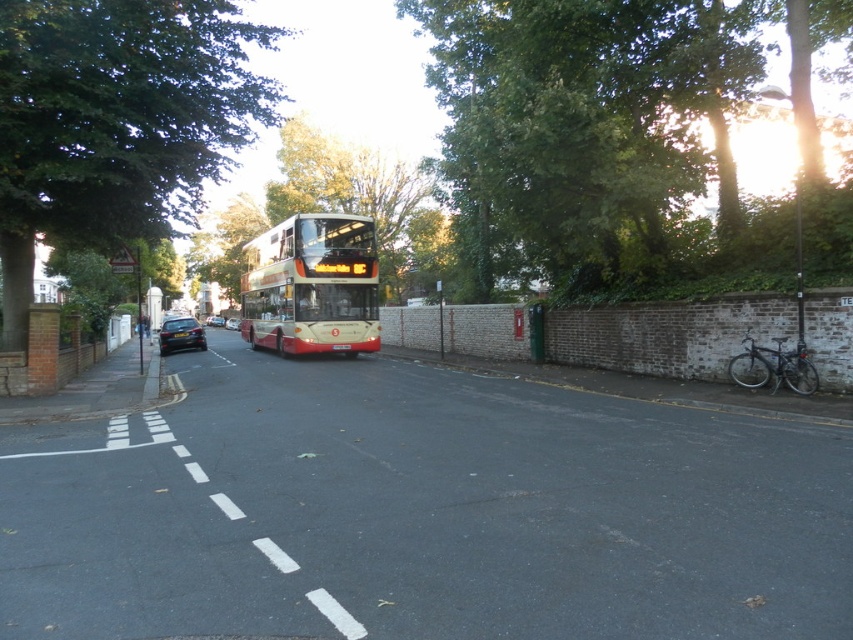
You are a pedestrian standing at the point with coordinates point (634, 113) and want to cross the road to reach the point with coordinates point (338, 348). Given the presence of the double yellow line and the bus moving towards you, is it safe to cross directly in front of the bus?

Point (634, 113) is in front of point (338, 348). Since the bus is moving towards you and you are in front of your destination point, crossing directly in front of the bus would put you in its path, making it unsafe. Wait for a safer opportunity.

You are a pedestrian standing at the edge of the road. You see a green leafy tree at upper right and a white plastic license plate at center. Which object is closer to the right side of the image?

The green leafy tree at upper right is closer to the right side of the image because it is positioned to the right of the white plastic license plate at center.